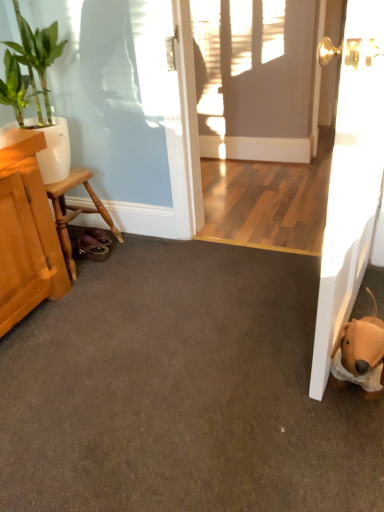
Identify the location of free space between wooden stool at left and brown plush dog at lower right. The width and height of the screenshot is (384, 512). (190, 310).